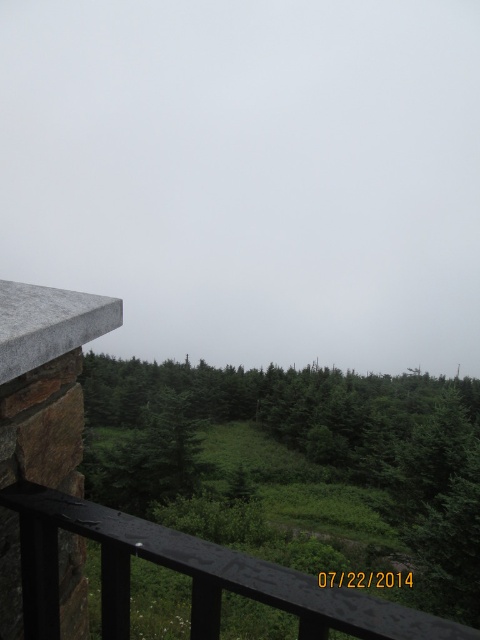
You are standing on the balcony and want to take a photo of the green matte tree at center without the black wood rail at lower left blocking the view. Which direction should you move to ensure the tree is fully visible?

The green matte tree at center is positioned on the right side of the black wood rail at lower left. To avoid the rail blocking the view, you should move to the left side of the black wood rail at lower left so the tree is no longer obscured.